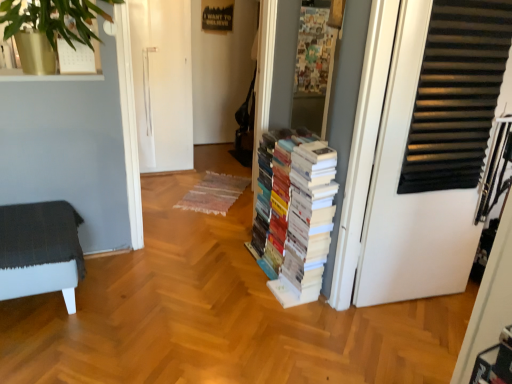
This screenshot has width=512, height=384. Find the location of `dark gray fabric ottoman at left`. dark gray fabric ottoman at left is located at coordinates (40, 250).

The image size is (512, 384). I want to click on white paper books at center, so click(x=301, y=209).

Locate an element on the screen. Image resolution: width=512 pixels, height=384 pixels. dark gray fabric ottoman at left is located at coordinates (40, 250).

From a real-world perspective, relative to dark gray fabric ottoman at left, is white paper books at center vertically above or below?

Clearly, from a real-world perspective, white paper books at center is above dark gray fabric ottoman at left.

Is point (280, 176) closer or farther from the camera than point (27, 287)?

Point (280, 176) is farther from the camera than point (27, 287).

Which of these two, white paper books at center or dark gray fabric ottoman at left, is bigger?

With larger size is white paper books at center.

Which object is wider, white paper books at center or dark gray fabric ottoman at left?

With larger width is dark gray fabric ottoman at left.

Considering the sizes of objects white matte door at right and white paper books at center in the image provided, who is thinner, white matte door at right or white paper books at center?

With smaller width is white matte door at right.

Which is in front, white matte door at right or white paper books at center?

Positioned in front is white matte door at right.

In the scene shown: Can you confirm if white matte door at right is smaller than white paper books at center?

Indeed, white matte door at right has a smaller size compared to white paper books at center.

Is dark gray fabric ottoman at left surrounding white paper books at center?

No, white paper books at center is located outside of dark gray fabric ottoman at left.

Which is behind, point (12, 226) or point (309, 277)?

Point (309, 277)

Can you confirm if dark gray fabric ottoman at left is positioned to the right of white paper books at center?

In fact, dark gray fabric ottoman at left is to the left of white paper books at center.

Are dark gray fabric ottoman at left and white paper books at center far apart?

That's right, there is a large distance between dark gray fabric ottoman at left and white paper books at center.

Does white matte door at right have a larger size compared to dark gray fabric ottoman at left?

No.

Are white matte door at right and dark gray fabric ottoman at left far apart?

Absolutely, white matte door at right is distant from dark gray fabric ottoman at left.

From the picture: Is white matte door at right not inside dark gray fabric ottoman at left?

white matte door at right is positioned outside dark gray fabric ottoman at left.

In the scene shown: Considering the relative sizes of white paper books at center and white matte door at right in the image provided, is white paper books at center taller than white matte door at right?

In fact, white paper books at center may be shorter than white matte door at right.

Which is more to the left, white paper books at center or white matte door at right?

Positioned to the left is white paper books at center.

Consider the image. Does white paper books at center lie in front of white matte door at right?

No, it is not.

From a real-world perspective, is white paper books at center physically below white matte door at right?

Yes, from a real-world perspective, white paper books at center is beneath white matte door at right.

Which object is closer to the camera taking this photo, dark gray fabric ottoman at left or white matte door at right?

white matte door at right.

In the scene shown: Is dark gray fabric ottoman at left facing towards white matte door at right?

No.

Is dark gray fabric ottoman at left next to white matte door at right and touching it?

No.

Locate an element on the screen. This screenshot has width=512, height=384. book behind the dark gray fabric ottoman at left is located at coordinates (301, 209).

The width and height of the screenshot is (512, 384). What are the coordinates of `book on the left of the white matte door at right` in the screenshot? It's located at (301, 209).

Which object lies further to the anchor point white paper books at center, dark gray fabric ottoman at left or white matte door at right?

Among the two, dark gray fabric ottoman at left is located further to white paper books at center.

Which object lies nearer to the anchor point white matte door at right, dark gray fabric ottoman at left or white paper books at center?

white paper books at center is positioned closer to the anchor white matte door at right.

From the picture: Estimate the real-world distances between objects in this image. Which object is further from dark gray fabric ottoman at left, white paper books at center or white matte door at right?

white matte door at right.

Considering their positions, is white matte door at right positioned closer to white paper books at center than dark gray fabric ottoman at left?

white matte door at right lies closer to white paper books at center than the other object.

From the image, which object appears to be farther from white matte door at right, white paper books at center or dark gray fabric ottoman at left?

dark gray fabric ottoman at left.

From the image, which object appears to be nearer to dark gray fabric ottoman at left, white matte door at right or white paper books at center?

white paper books at center is positioned closer to the anchor dark gray fabric ottoman at left.

Find the location of `book located between dark gray fabric ottoman at left and white matte door at right in the left-right direction`. book located between dark gray fabric ottoman at left and white matte door at right in the left-right direction is located at coordinates (301, 209).